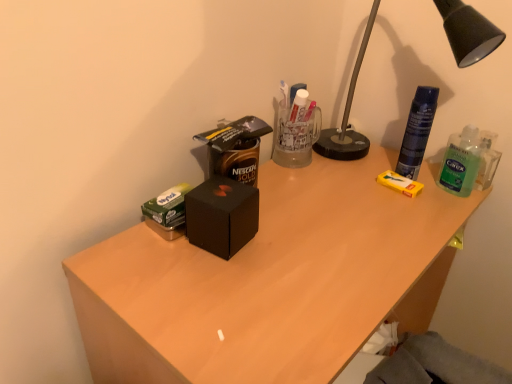
Locate an element on the screen. Image resolution: width=512 pixels, height=384 pixels. vacant space underneath black metal lamp at upper right (from a real-world perspective) is located at coordinates (382, 163).